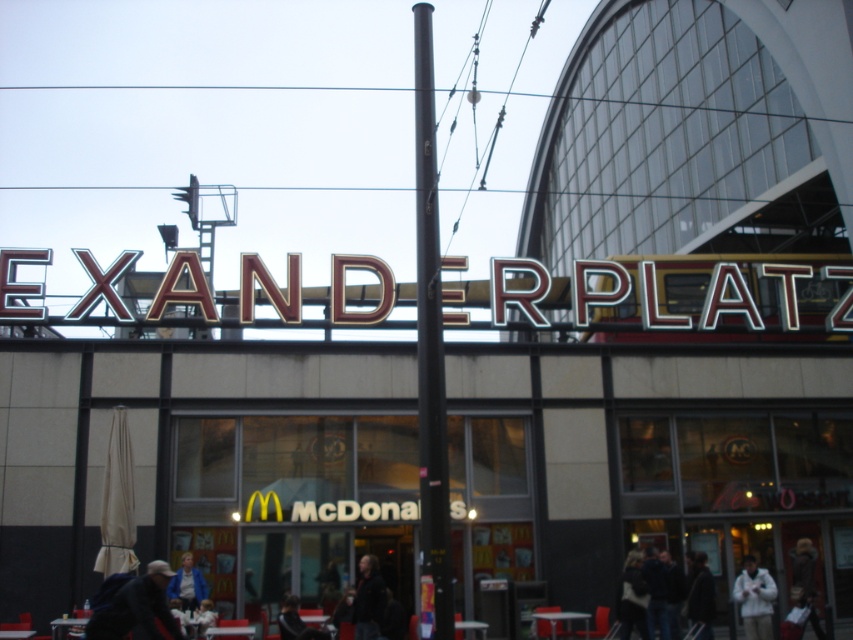
Is point (115, 604) behind point (808, 573)?

No, (115, 604) is in front of (808, 573).

Between dark blue jacket at lower left and dark brown fur coat at lower right, which one appears on the right side from the viewer's perspective?

dark brown fur coat at lower right

Is point (88, 634) in front of point (793, 600)?

Yes, point (88, 634) is in front of point (793, 600).

This screenshot has height=640, width=853. What are the coordinates of `dark blue jacket at lower left` in the screenshot? It's located at (137, 609).

Does point (126, 316) come behind point (186, 563)?

Yes, point (126, 316) is farther from viewer.

Is metallic gold sign at upper center taller than blue fabric jacket at center?

Yes, metallic gold sign at upper center is taller than blue fabric jacket at center.

Is point (733, 326) less distant than point (190, 576)?

No, it is behind (190, 576).

Find the location of a particular element. The width and height of the screenshot is (853, 640). metallic gold sign at upper center is located at coordinates (669, 294).

Is black metal pole at center positioned before dark brown fur coat at lower right?

Yes, it is in front of dark brown fur coat at lower right.

Is black metal pole at center to the right of dark brown fur coat at lower right from the viewer's perspective?

In fact, black metal pole at center is to the left of dark brown fur coat at lower right.

Between point (434, 365) and point (807, 563), which one is positioned behind?

Positioned behind is point (807, 563).

Find the location of a particular element. The image size is (853, 640). black metal pole at center is located at coordinates (430, 355).